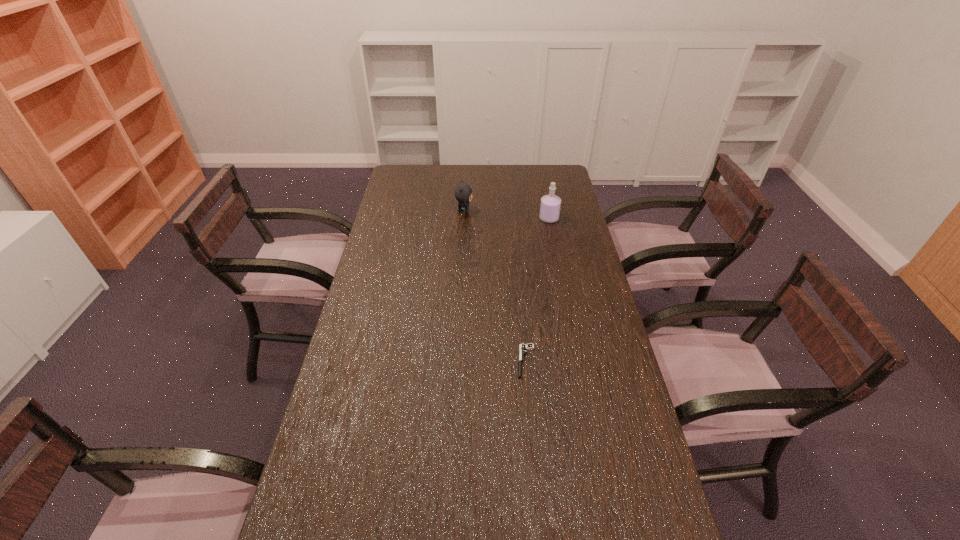
You are a GUI agent. You are given a task and a screenshot of the screen. Output one action in this format:
    pyautogui.click(x=<x>, y=<y>)
    Task: Click on the vacant area that lies between the shortest object and the kitten
    The image size is (960, 540).
    Given the screenshot: What is the action you would take?
    pyautogui.click(x=495, y=286)

This screenshot has width=960, height=540. Identify the location of free spot between the rightmost object and the kitten. (507, 215).

Find the location of a particular element. Image resolution: width=960 pixels, height=540 pixels. free space that is in between the rightmost object and the kitten is located at coordinates (507, 215).

Locate an element on the screen. Image resolution: width=960 pixels, height=540 pixels. free spot between the kitten and the rightmost object is located at coordinates (507, 215).

Locate an element on the screen. The height and width of the screenshot is (540, 960). vacant space that's between the second object from left to right and the second tallest object is located at coordinates (495, 286).

At what (x,y) coordinates should I click in order to perform the action: click on unoccupied area between the pistol and the leftmost object. Please return your answer as a coordinate pair (x, y). Image resolution: width=960 pixels, height=540 pixels. Looking at the image, I should click on (495, 286).

Point out which object is positioned as the second nearest to the pistol. Please provide its 2D coordinates. Your answer should be formatted as a tuple, i.e. [(x, y)], where the tuple contains the x and y coordinates of a point satisfying the conditions above.

[(463, 193)]

Identify which object is the nearest to the nearest object. Please provide its 2D coordinates. Your answer should be formatted as a tuple, i.e. [(x, y)], where the tuple contains the x and y coordinates of a point satisfying the conditions above.

[(550, 205)]

This screenshot has height=540, width=960. Identify the location of blank space that satisfies the following two spatial constraints: 1. on the front-facing side of the rightmost object; 2. on the right side of the kitten. pos(464,219).

You are a GUI agent. You are given a task and a screenshot of the screen. Output one action in this format:
    pyautogui.click(x=<x>, y=<y>)
    Task: Click on the free location that satisfies the following two spatial constraints: 1. on the front-facing side of the second shortest object; 2. on the left side of the perfume
    Image resolution: width=960 pixels, height=540 pixels.
    Given the screenshot: What is the action you would take?
    pyautogui.click(x=464, y=219)